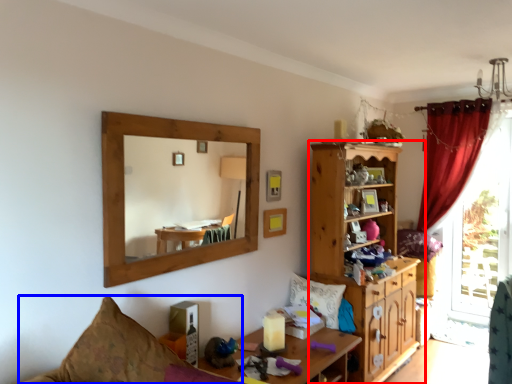
Question: Which point is further to the camera, cabinetry (highlighted by a red box) or couch (highlighted by a blue box)?

Choices:
 (A) cabinetry
 (B) couch

Answer: (A)